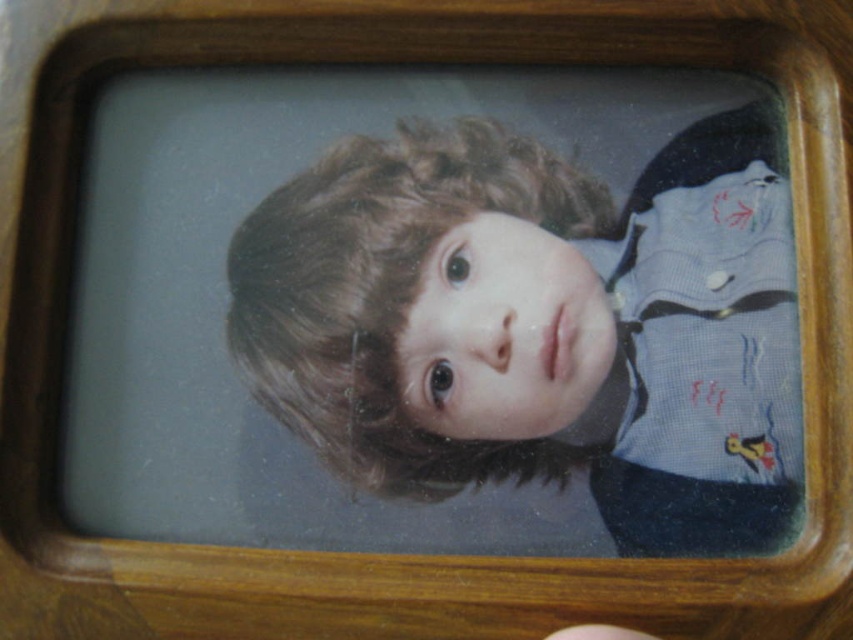
You are an artist trying to sketch the portrait in the frame. You want to ensure the proportions are accurate. Which object, the smooth blue shirt at center or the smooth skin face at center, has a greater width in the image?

The smooth blue shirt at center might be wider than smooth skin face at center according to the description.

In the scene shown: Looking at the framed photograph, you notice two elements inside the frame. One is the smooth skin face at center and the other is the brown leather hand at lower center. Based on their sizes in the image, which one appears to be closer to the camera?

The smooth skin face at center appears closer to the camera because its width is larger than the brown leather hand at lower center.